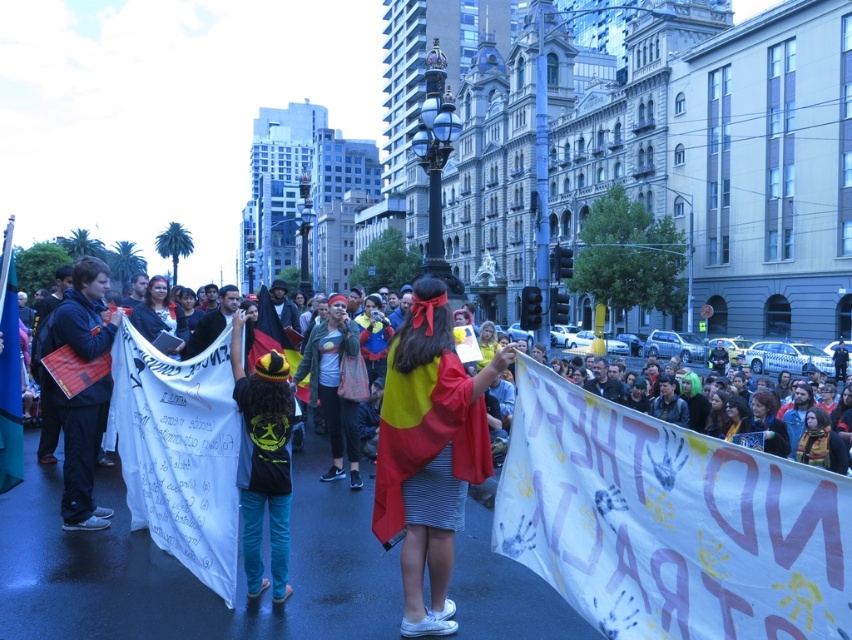
You are a photographer trying to capture a wide shot of the protest scene. You notice the dark blue jacket at left and the denim jacket at center. Which jacket would require you to zoom in less to include its full width in the frame?

The dark blue jacket at left has a greater width than the denim jacket at center, so you would need to zoom in less to capture the entire dark blue jacket at left in the frame.